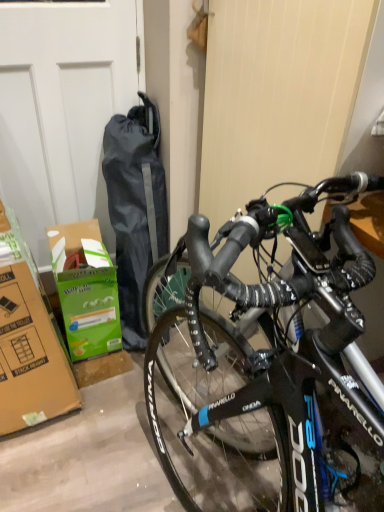
Question: Can you confirm if white matte garage door at upper left is taller than green cardboard box at lower left?

Choices:
 (A) no
 (B) yes

Answer: (B)

Question: Can you confirm if white matte garage door at upper left is positioned to the right of green cardboard box at lower left?

Choices:
 (A) yes
 (B) no

Answer: (B)

Question: From the image's perspective, would you say white matte garage door at upper left is shown under green cardboard box at lower left?

Choices:
 (A) no
 (B) yes

Answer: (A)

Question: Is white matte garage door at upper left wider than green cardboard box at lower left?

Choices:
 (A) no
 (B) yes

Answer: (A)

Question: Is white matte garage door at upper left further to the viewer compared to green cardboard box at lower left?

Choices:
 (A) no
 (B) yes

Answer: (A)

Question: From the image's perspective, is white matte garage door at upper left on top of green cardboard box at lower left?

Choices:
 (A) no
 (B) yes

Answer: (B)

Question: Can you confirm if green cardboard box at lower left is bigger than white matte garage door at upper left?

Choices:
 (A) no
 (B) yes

Answer: (A)

Question: Does green cardboard box at lower left contain white matte garage door at upper left?

Choices:
 (A) yes
 (B) no

Answer: (B)

Question: Is green cardboard box at lower left oriented towards white matte garage door at upper left?

Choices:
 (A) yes
 (B) no

Answer: (B)

Question: Considering the relative positions of green cardboard box at lower left and white matte garage door at upper left in the image provided, is green cardboard box at lower left behind white matte garage door at upper left?

Choices:
 (A) yes
 (B) no

Answer: (A)

Question: Does green cardboard box at lower left have a greater width compared to white matte garage door at upper left?

Choices:
 (A) no
 (B) yes

Answer: (B)

Question: From the image's perspective, is green cardboard box at lower left on white matte garage door at upper left?

Choices:
 (A) no
 (B) yes

Answer: (A)

Question: Considering the positions of point (86, 248) and point (61, 222), is point (86, 248) closer or farther from the camera than point (61, 222)?

Choices:
 (A) closer
 (B) farther

Answer: (A)